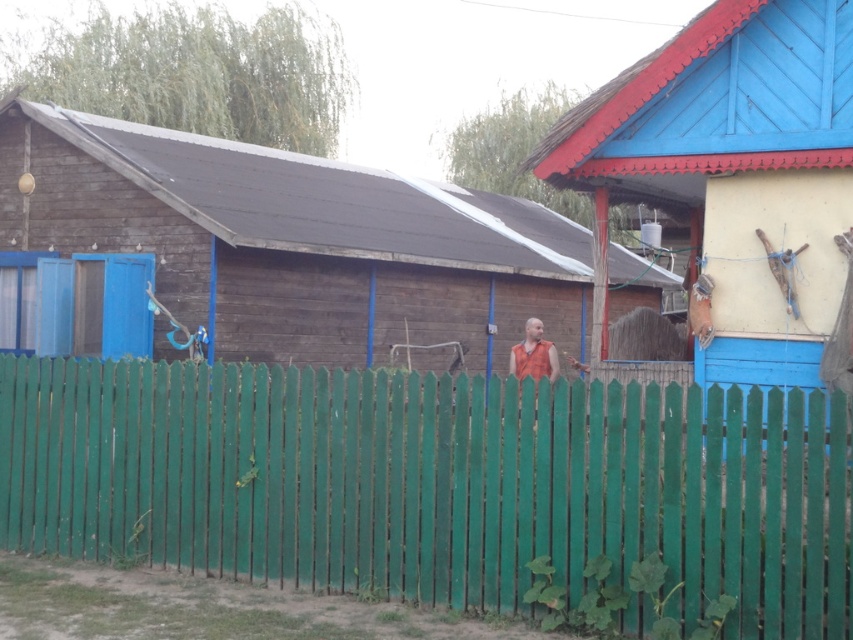
Question: Among these objects, which one is nearest to the camera?

Choices:
 (A) blue wooden hut at right
 (B) green wooden fence at center
 (C) wooden hut at center

Answer: (B)

Question: Among these points, which one is farthest from the camera?

Choices:
 (A) (535, 352)
 (B) (850, 97)
 (C) (473, 273)

Answer: (C)

Question: Which is farther from the wooden hut at center?

Choices:
 (A) orange fabric vest at center
 (B) blue wooden hut at right

Answer: (B)

Question: Does green wooden fence at center appear over wooden hut at center?

Choices:
 (A) no
 (B) yes

Answer: (A)

Question: Is green wooden fence at center wider than blue wooden hut at right?

Choices:
 (A) no
 (B) yes

Answer: (B)

Question: Is green wooden fence at center above blue wooden hut at right?

Choices:
 (A) yes
 (B) no

Answer: (B)